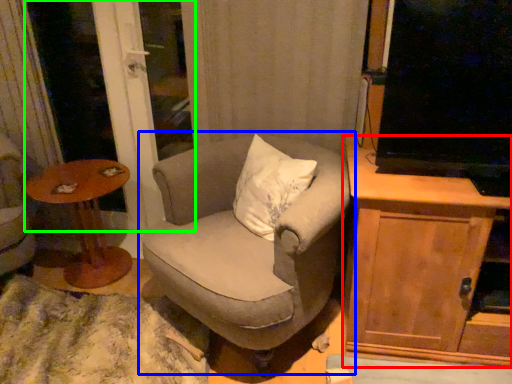
Question: Considering the real-world distances, which object is closest to cabinetry (highlighted by a red box)? chair (highlighted by a blue box) or screen door (highlighted by a green box).

Choices:
 (A) chair
 (B) screen door

Answer: (A)